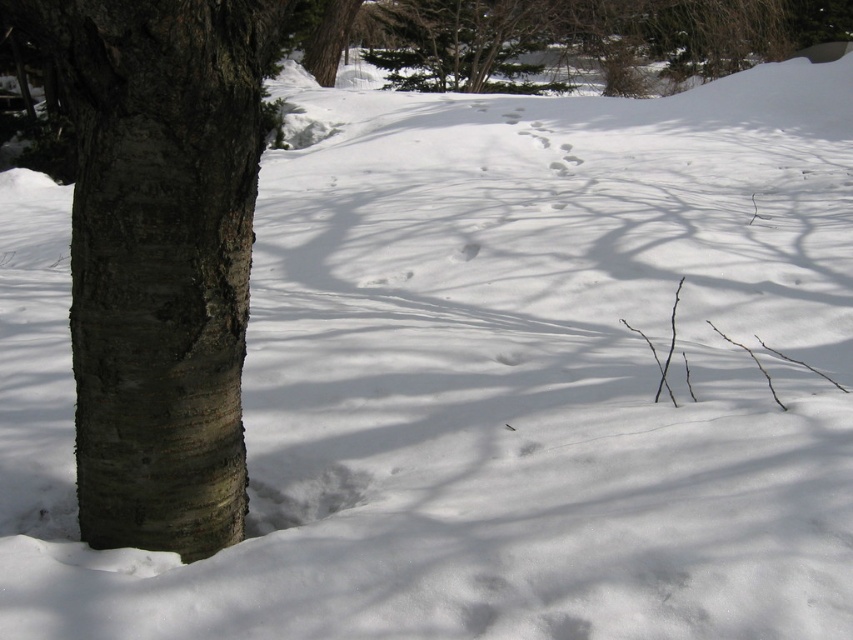
Question: Can you confirm if smooth bark tree trunk at left is smaller than green textured pine tree at upper center?

Choices:
 (A) no
 (B) yes

Answer: (A)

Question: Does smooth bark tree trunk at left come behind green textured pine tree at upper center?

Choices:
 (A) no
 (B) yes

Answer: (A)

Question: Is smooth bark tree trunk at left further to camera compared to green textured pine tree at upper center?

Choices:
 (A) no
 (B) yes

Answer: (A)

Question: Which of the following is the farthest from the observer?

Choices:
 (A) smooth bark tree trunk at left
 (B) green textured pine tree at upper center

Answer: (B)

Question: Which point is closer to the camera taking this photo?

Choices:
 (A) (119, 396)
 (B) (740, 38)

Answer: (A)